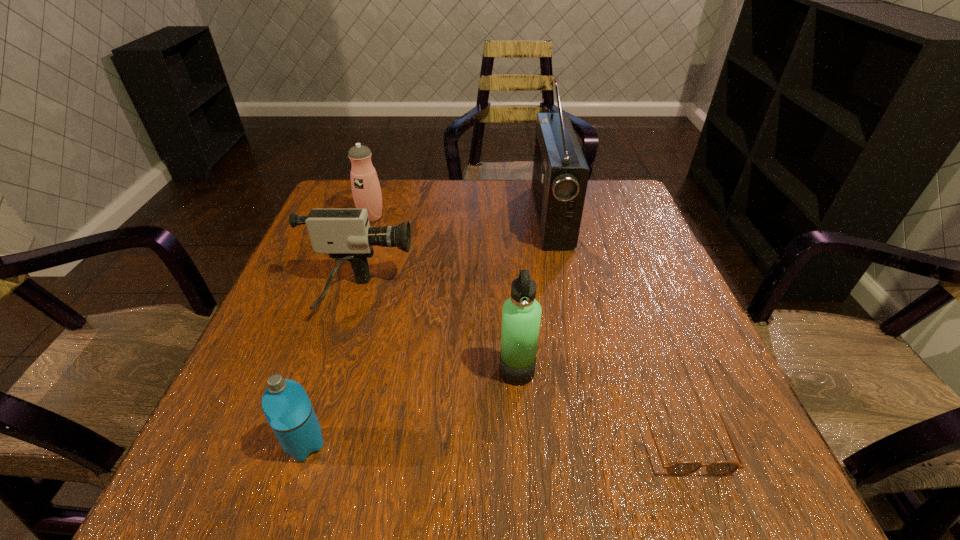
Where is `thermos bottle that stands as the second closest to the shortest thermos bottle`? Image resolution: width=960 pixels, height=540 pixels. thermos bottle that stands as the second closest to the shortest thermos bottle is located at coordinates (366, 190).

You are a GUI agent. You are given a task and a screenshot of the screen. Output one action in this format:
    pyautogui.click(x=<x>, y=<y>)
    Task: Click on the free space that satisfies the following two spatial constraints: 1. on the recording direction of the third nearest object; 2. on the right side of the camcorder
    This screenshot has height=540, width=960.
    Given the screenshot: What is the action you would take?
    pyautogui.click(x=336, y=371)